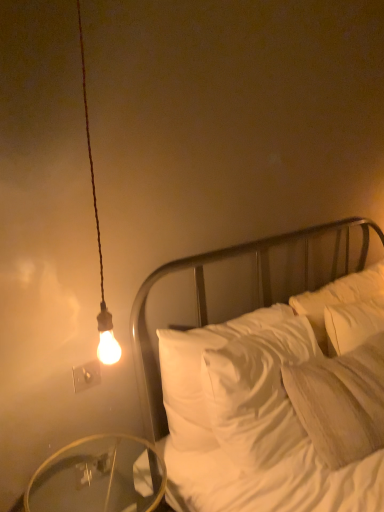
Question: Does white satin bed at center contain transparent glass table at lower left?

Choices:
 (A) no
 (B) yes

Answer: (A)

Question: From a real-world perspective, is white satin bed at center physically above transparent glass table at lower left?

Choices:
 (A) yes
 (B) no

Answer: (A)

Question: Does white satin bed at center turn towards transparent glass table at lower left?

Choices:
 (A) yes
 (B) no

Answer: (B)

Question: Is white satin bed at center not near transparent glass table at lower left?

Choices:
 (A) no
 (B) yes

Answer: (A)

Question: From the image's perspective, is white satin bed at center below transparent glass table at lower left?

Choices:
 (A) yes
 (B) no

Answer: (B)

Question: Is white satin bed at center oriented away from transparent glass table at lower left?

Choices:
 (A) yes
 (B) no

Answer: (B)

Question: Is transparent glass table at lower left completely or partially inside white plastic electric outlet at upper left?

Choices:
 (A) yes
 (B) no

Answer: (B)

Question: From the image's perspective, is white plastic electric outlet at upper left on top of transparent glass table at lower left?

Choices:
 (A) yes
 (B) no

Answer: (A)

Question: Does white plastic electric outlet at upper left have a larger size compared to transparent glass table at lower left?

Choices:
 (A) yes
 (B) no

Answer: (B)

Question: Does white plastic electric outlet at upper left come behind transparent glass table at lower left?

Choices:
 (A) yes
 (B) no

Answer: (A)

Question: From the image's perspective, is white plastic electric outlet at upper left located beneath transparent glass table at lower left?

Choices:
 (A) no
 (B) yes

Answer: (A)

Question: Is white plastic electric outlet at upper left facing away from transparent glass table at lower left?

Choices:
 (A) no
 (B) yes

Answer: (A)

Question: From the image's perspective, is transparent glass table at lower left located above white satin bed at center?

Choices:
 (A) yes
 (B) no

Answer: (B)